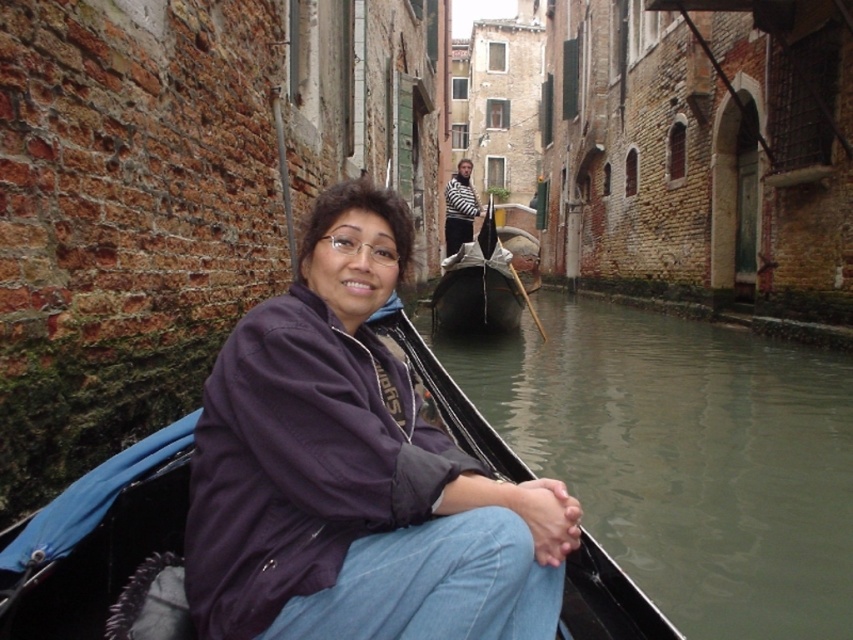
Question: Does purple fabric jacket at center appear on the right side of greenish water at lower left?

Choices:
 (A) no
 (B) yes

Answer: (A)

Question: Among these points, which one is farthest from the camera?

Choices:
 (A) (850, 465)
 (B) (538, 323)
 (C) (201, 528)

Answer: (B)

Question: Where is purple fabric jacket at center located in relation to greenish water at lower left in the image?

Choices:
 (A) above
 (B) below

Answer: (A)

Question: Is purple fabric jacket at center smaller than greenish water at lower left?

Choices:
 (A) yes
 (B) no

Answer: (A)

Question: Which point is farther from the camera taking this photo?

Choices:
 (A) click(640, 547)
 (B) click(347, 410)

Answer: (A)

Question: Which point is farther from the camera taking this photo?

Choices:
 (A) (717, 534)
 (B) (573, 540)

Answer: (A)